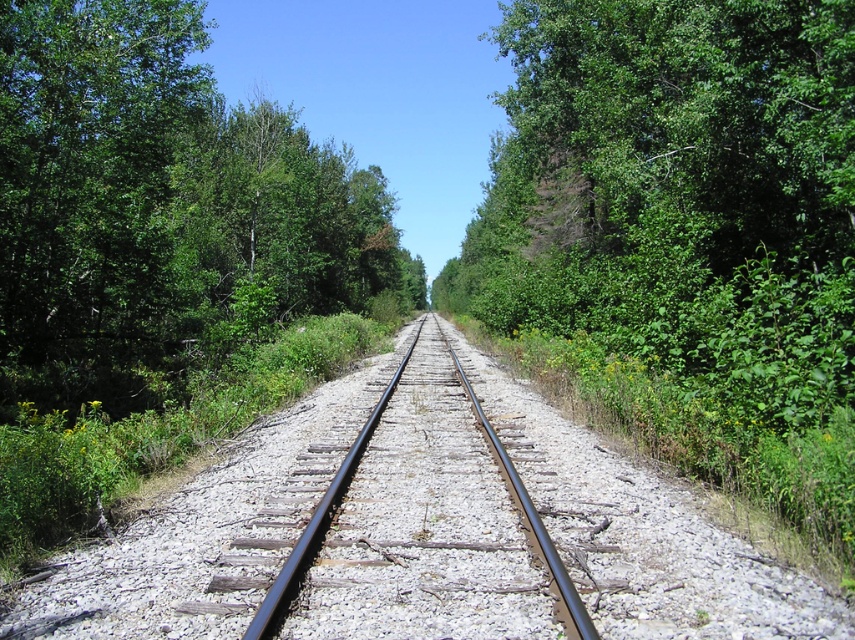
Question: Is green leafy tree at center positioned before black metal train track at center?

Choices:
 (A) yes
 (B) no

Answer: (B)

Question: Which point appears farthest from the camera in this image?

Choices:
 (A) (x=16, y=352)
 (B) (x=491, y=611)

Answer: (A)

Question: Is green leafy tree at center thinner than black metal train track at center?

Choices:
 (A) yes
 (B) no

Answer: (B)

Question: In this image, where is green leafy tree at center located relative to black metal train track at center?

Choices:
 (A) below
 (B) above

Answer: (B)

Question: Which of the following is the closest to the observer?

Choices:
 (A) (166, 188)
 (B) (578, 620)

Answer: (B)